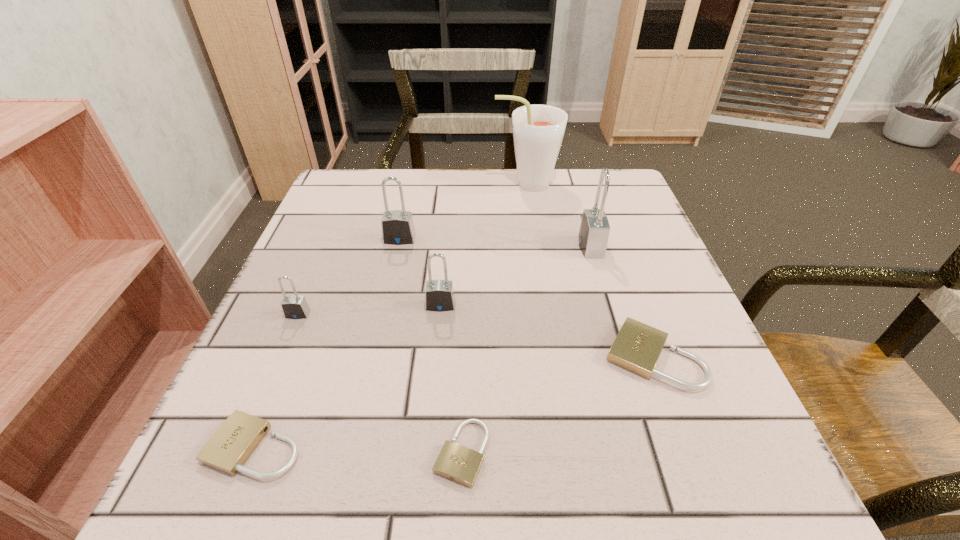
The width and height of the screenshot is (960, 540). I want to click on the second closest gray padlock to the seventh shortest object, so click(397, 226).

Locate an element on the screen. The height and width of the screenshot is (540, 960). the second closest gray padlock relative to the third object from left to right is located at coordinates [x=295, y=306].

Where is `the second closest beige padlock to the sixth shortest padlock`? the second closest beige padlock to the sixth shortest padlock is located at coordinates (637, 347).

At what (x,y) coordinates should I click in order to perform the action: click on beige padlock that is the closest to the fifth shortest object. Please return your answer as a coordinate pair (x, y). Image resolution: width=960 pixels, height=540 pixels. Looking at the image, I should click on (455, 462).

You are a GUI agent. You are given a task and a screenshot of the screen. Output one action in this format:
    pyautogui.click(x=<x>, y=<y>)
    Task: Click on the free space that satisfies the following two spatial constraints: 1. on the drink side of the tallest object; 2. on the shackle of the fourth tallest object
    The image size is (960, 540).
    Given the screenshot: What is the action you would take?
    pyautogui.click(x=544, y=305)

You are a GUI agent. You are given a task and a screenshot of the screen. Output one action in this format:
    pyautogui.click(x=<x>, y=<y>)
    Task: Click on the vacant space that satisfies the following two spatial constraints: 1. on the drink side of the farthest object; 2. on the shackle of the second smallest gray padlock
    This screenshot has width=960, height=540.
    Given the screenshot: What is the action you would take?
    pyautogui.click(x=544, y=305)

Where is `vacant space that satisfies the following two spatial constraints: 1. on the drink side of the root beer; 2. on the front side of the second shortest object`? vacant space that satisfies the following two spatial constraints: 1. on the drink side of the root beer; 2. on the front side of the second shortest object is located at coordinates (565, 447).

The height and width of the screenshot is (540, 960). I want to click on free location that satisfies the following two spatial constraints: 1. on the shackle of the second beige padlock from left to right; 2. on the right side of the second gray padlock from left to right, so click(352, 453).

Identify the location of free space that satisfies the following two spatial constraints: 1. on the back side of the sixth tallest object; 2. on the right side of the second beige padlock from right to left. This screenshot has height=540, width=960. (465, 356).

The width and height of the screenshot is (960, 540). I want to click on free space that satisfies the following two spatial constraints: 1. on the drink side of the tallest object; 2. on the front side of the shortest object, so click(566, 453).